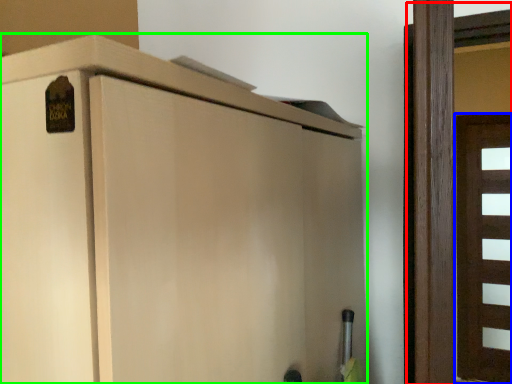
Question: Based on their relative distances, which object is nearer to door (highlighted by a red box)? Choose from door (highlighted by a blue box) and cupboard (highlighted by a green box).

Choices:
 (A) door
 (B) cupboard

Answer: (B)